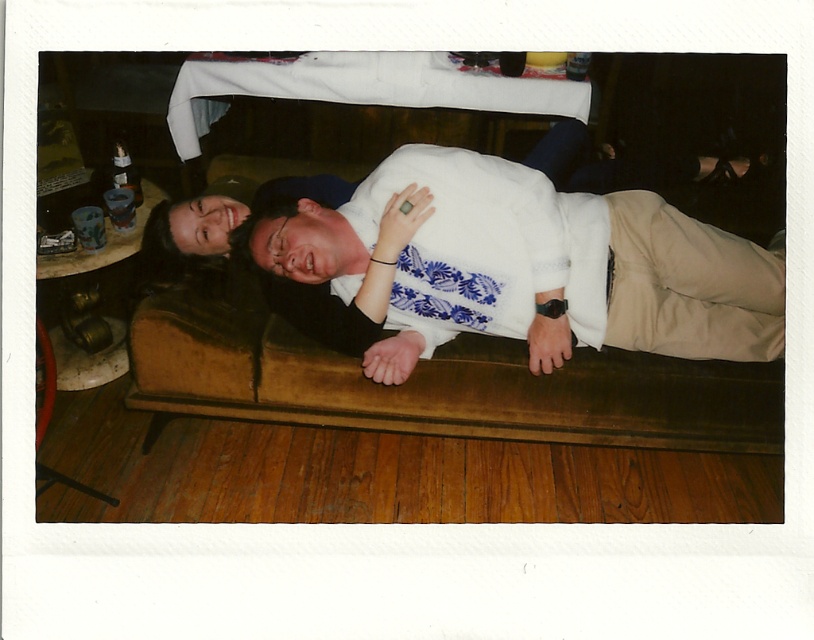
You are a photographer setting up a shoot in this cozy indoor setting. You need to place a large equipment bag that requires 1.2 meters of space. Looking at the brown leather couch at center and the white fabric shirt at center, which object can accommodate the bag based on their size?

The brown leather couch at center is larger in size than the white fabric shirt at center, so the equipment bag can be placed on the brown leather couch at center as it has sufficient space.

You are a photographer setting up a shoot in the scene. You need to place a small lamp between the brown leather couch at center and the white fabric shirt at center. Based on their positions, which side of the couch should the lamp be placed on to be between them?

The brown leather couch at center is to the left of white fabric shirt at center, so the lamp should be placed to the right side of the brown leather couch at center to be between them.

You are standing in the room and want to reach both the point at coordinates (681, 371) and the point at (423, 353). Which point will you reach first if you move straight towards them?

You will reach point (423, 353) first because it is closer to you than point (681, 371), which is further away.